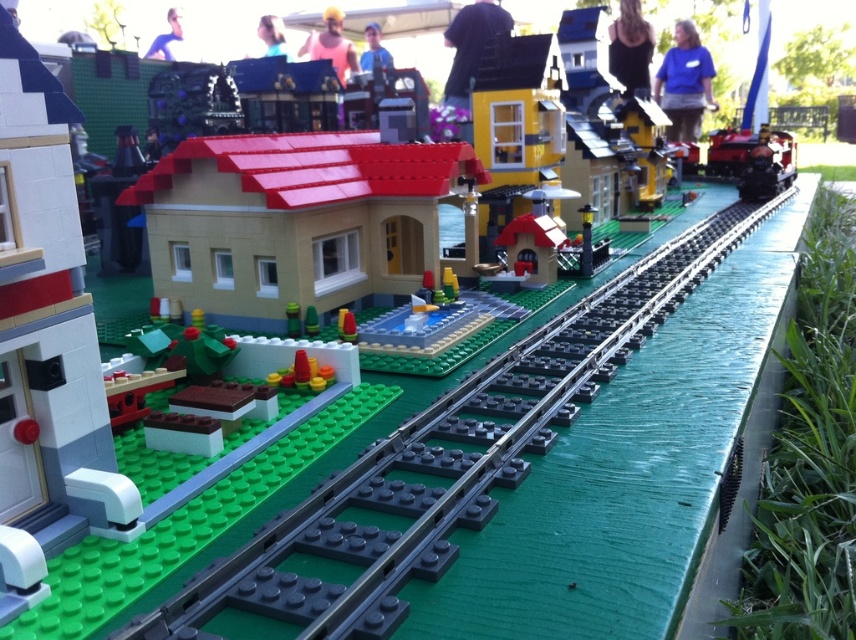
You are a Lego figure standing at the base of the tracks. You see the matte black hat at upper center and the blue fabric shirt at upper center. Which object is wider from your perspective?

The matte black hat at upper center might be wider than blue fabric shirt at upper center according to the description.